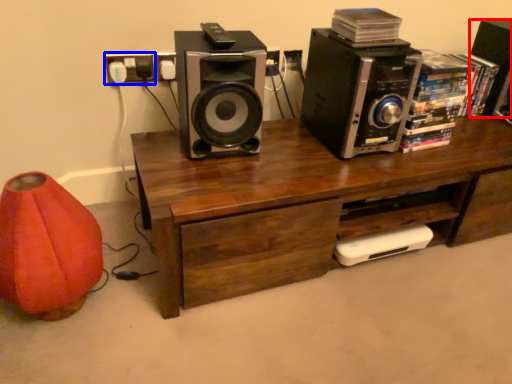
Question: Which object appears closest to the camera in this image, speaker (highlighted by a red box) or electric outlet (highlighted by a blue box)?

Choices:
 (A) speaker
 (B) electric outlet

Answer: (B)